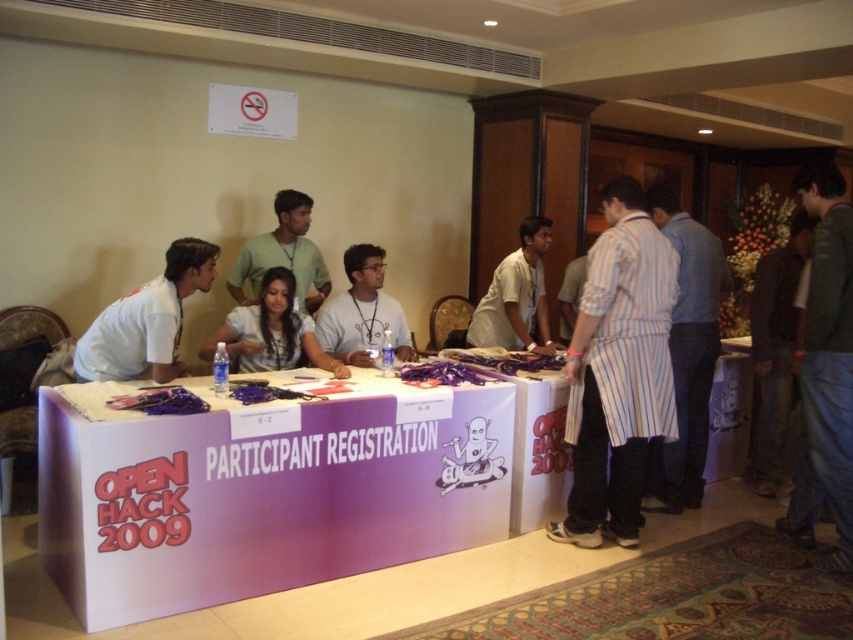
Can you confirm if white striped shirt at center is shorter than matte white shirt at center?

No, white striped shirt at center is not shorter than matte white shirt at center.

Between point (503, 317) and point (396, 310), which one is positioned in front?

Positioned in front is point (396, 310).

I want to click on white striped shirt at center, so click(x=515, y=296).

Can you confirm if purple paperboard at center is bigger than white matte shirt at center?

Yes.

Who is higher up, purple paperboard at center or white matte shirt at center?

white matte shirt at center is higher up.

This screenshot has width=853, height=640. Identify the location of purple paperboard at center. (263, 497).

Does striped cotton shirt at center have a smaller size compared to white t-shirt at center?

Actually, striped cotton shirt at center might be larger than white t-shirt at center.

Can you confirm if striped cotton shirt at center is thinner than white t-shirt at center?

Indeed, striped cotton shirt at center has a lesser width compared to white t-shirt at center.

Between point (663, 220) and point (241, 355), which one is positioned behind?

The point (663, 220) is more distant.

Locate an element on the screen. striped cotton shirt at center is located at coordinates (688, 352).